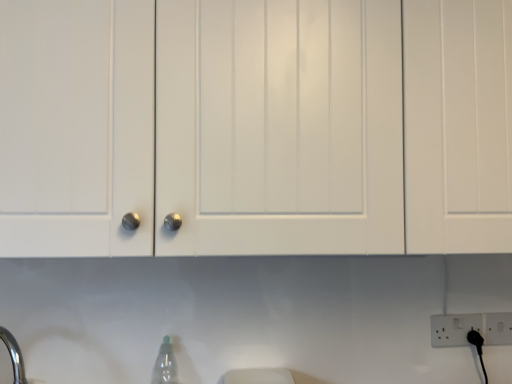
Question: Considering the positions of white plastic electric outlet at lower right and transparent plastic bottle at lower center in the image, is white plastic electric outlet at lower right wider or thinner than transparent plastic bottle at lower center?

Choices:
 (A) wide
 (B) thin

Answer: (B)

Question: Is white plastic electric outlet at lower right in front of or behind transparent plastic bottle at lower center in the image?

Choices:
 (A) behind
 (B) front

Answer: (A)

Question: Considering the real-world distances, which object is farthest from the white plastic electric outlet at lower right?

Choices:
 (A) transparent plastic bottle at lower center
 (B) white matte cabinet at center

Answer: (B)

Question: Considering the real-world distances, which object is farthest from the transparent plastic bottle at lower center?

Choices:
 (A) white matte cabinet at center
 (B) white plastic electric outlet at lower right

Answer: (B)